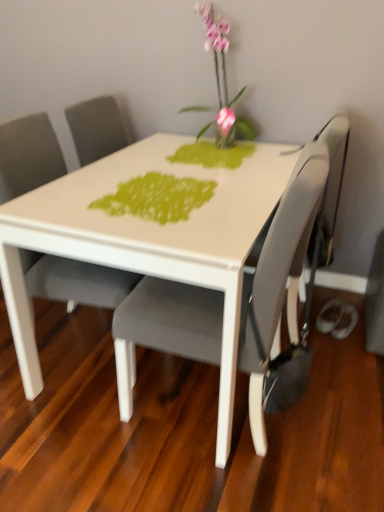
Question: Would you say matte gray chair at center, acting as the first chair starting from the right, is part of matte gray chair at center, arranged as the 2th chair when viewed from the right,'s contents?

Choices:
 (A) yes
 (B) no

Answer: (B)

Question: Is matte gray chair at center, the 2th chair viewed from the left, at the back of matte gray chair at center, the first chair in the left-to-right sequence?

Choices:
 (A) no
 (B) yes

Answer: (A)

Question: Could you tell me if matte gray chair at center, the first chair in the left-to-right sequence, is turned towards matte gray chair at center, the 2th chair viewed from the left?

Choices:
 (A) yes
 (B) no

Answer: (A)

Question: Is matte gray chair at center, arranged as the 2th chair when viewed from the right, shorter than matte gray chair at center, acting as the first chair starting from the right?

Choices:
 (A) no
 (B) yes

Answer: (B)

Question: Does matte gray chair at center, arranged as the 2th chair when viewed from the right, have a lesser width compared to matte gray chair at center, the 2th chair viewed from the left?

Choices:
 (A) yes
 (B) no

Answer: (A)

Question: In terms of size, does matte gray chair at center, the 2th chair viewed from the left, appear bigger or smaller than green textured placemat at center?

Choices:
 (A) big
 (B) small

Answer: (A)

Question: From a real-world perspective, is matte gray chair at center, the 2th chair viewed from the left, positioned above or below green textured placemat at center?

Choices:
 (A) above
 (B) below

Answer: (B)

Question: Considering the positions of matte gray chair at center, acting as the first chair starting from the right, and green textured placemat at center in the image, is matte gray chair at center, acting as the first chair starting from the right, taller or shorter than green textured placemat at center?

Choices:
 (A) tall
 (B) short

Answer: (A)

Question: In the image, is matte gray chair at center, acting as the first chair starting from the right, positioned in front of or behind green textured placemat at center?

Choices:
 (A) front
 (B) behind

Answer: (A)

Question: In the image, is green textured placemat at center positioned in front of or behind matte gray swivel chair at right?

Choices:
 (A) front
 (B) behind

Answer: (A)

Question: Looking at their shapes, would you say green textured placemat at center is wider or thinner than matte gray swivel chair at right?

Choices:
 (A) thin
 (B) wide

Answer: (B)

Question: From their relative heights in the image, would you say green textured placemat at center is taller or shorter than matte gray swivel chair at right?

Choices:
 (A) tall
 (B) short

Answer: (B)

Question: Choose the correct answer: Is green textured placemat at center inside matte gray swivel chair at right or outside it?

Choices:
 (A) inside
 (B) outside

Answer: (B)

Question: Is green textured placemat at center in front of or behind matte gray chair at center, arranged as the 2th chair when viewed from the right, in the image?

Choices:
 (A) behind
 (B) front

Answer: (B)

Question: From the image's perspective, is green textured placemat at center positioned above or below matte gray chair at center, the first chair in the left-to-right sequence?

Choices:
 (A) below
 (B) above

Answer: (B)